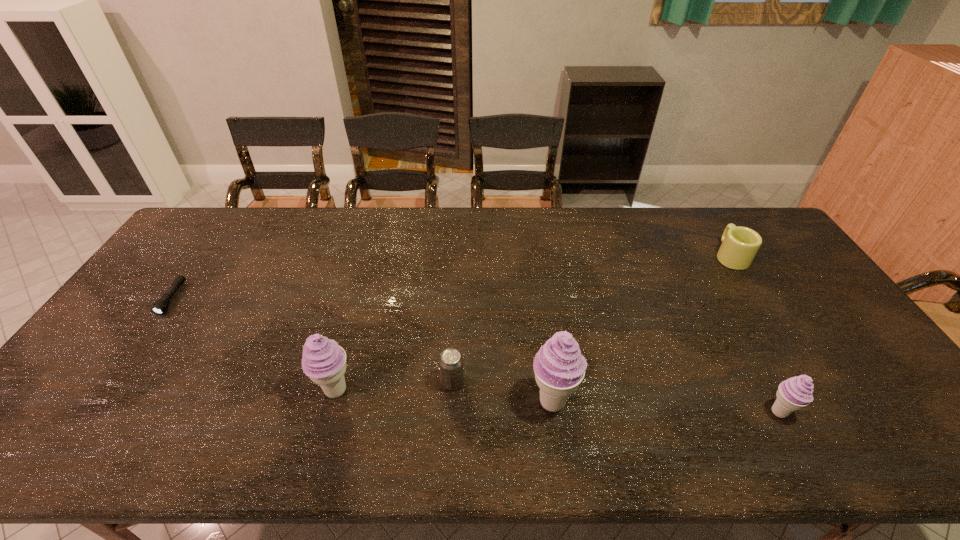
Where is `the second object from left to right`? Image resolution: width=960 pixels, height=540 pixels. the second object from left to right is located at coordinates (323, 360).

Identify the location of the second tallest icecream. The height and width of the screenshot is (540, 960). (323, 360).

The image size is (960, 540). Identify the location of the second icecream from right to left. (559, 367).

Image resolution: width=960 pixels, height=540 pixels. What are the coordinates of `the second object from right to left` in the screenshot? It's located at (794, 393).

Where is `the fourth shortest object`? Image resolution: width=960 pixels, height=540 pixels. the fourth shortest object is located at coordinates 794,393.

Find the location of a particular element. The height and width of the screenshot is (540, 960). the farthest object is located at coordinates (740, 245).

The image size is (960, 540). I want to click on the rightmost object, so click(x=740, y=245).

Identify the location of beer can. Image resolution: width=960 pixels, height=540 pixels. (451, 361).

The image size is (960, 540). What are the coordinates of `the fifth nearest object` in the screenshot? It's located at (161, 305).

Identify the location of flashlight. The width and height of the screenshot is (960, 540). (161, 305).